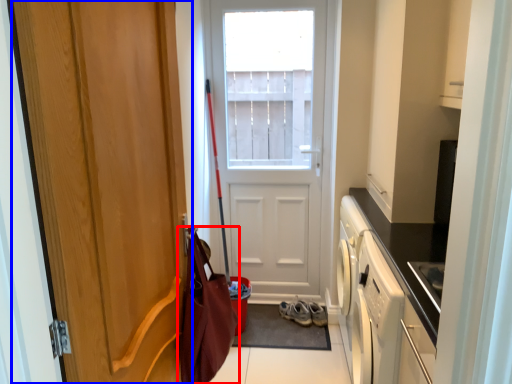
Question: Which object is further to the camera taking this photo, messenger bag (highlighted by a red box) or door (highlighted by a blue box)?

Choices:
 (A) messenger bag
 (B) door

Answer: (A)